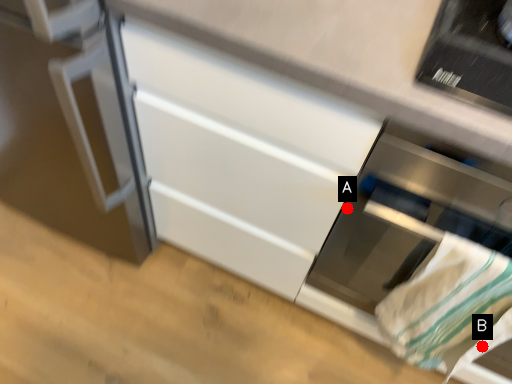
Question: Two points are circled on the image, labeled by A and B beside each circle. Among these points, which one is farthest from the camera?

Choices:
 (A) A is further
 (B) B is further

Answer: (A)